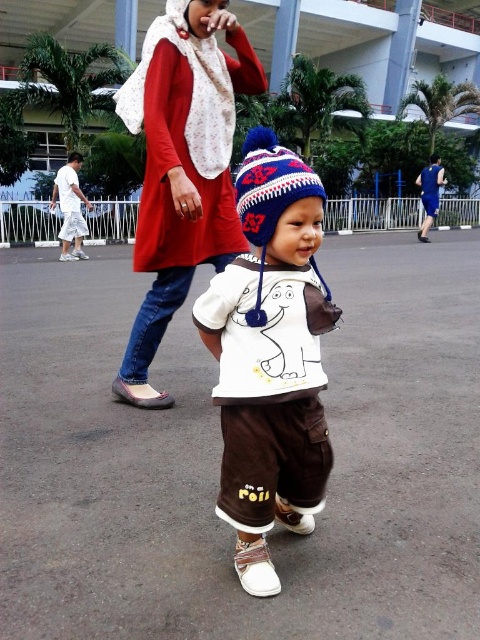
You are a photographer trying to capture a clear shot of both the white cotton shirt at center and the knitted woolen hat at center. Given their sizes, which object should you focus on first to ensure it fits within your camera frame?

The white cotton shirt at center is wider than the knitted woolen hat at center, so you should focus on capturing the white cotton shirt at center first to ensure it fits within the frame before adjusting for the smaller knitted woolen hat at center.